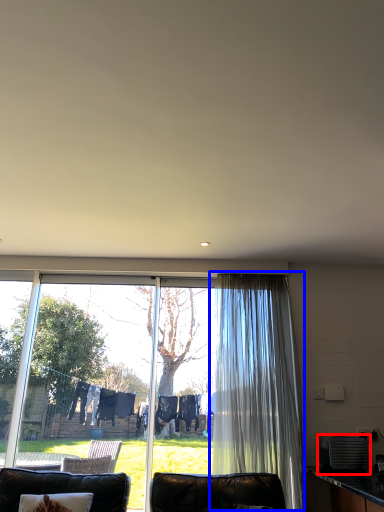
Question: Which point is further to the camera, appliance (highlighted by a red box) or curtain (highlighted by a blue box)?

Choices:
 (A) appliance
 (B) curtain

Answer: (B)